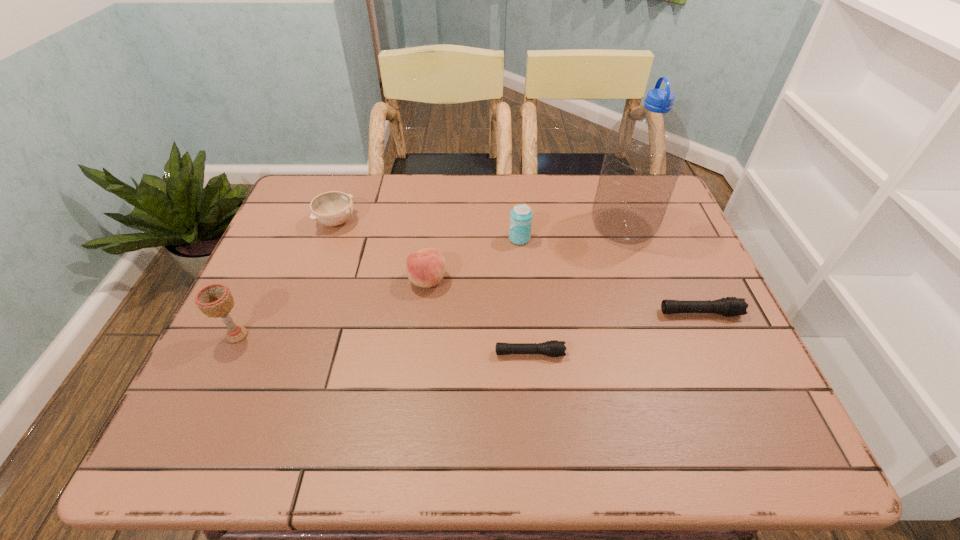
Locate an element on the screen. The width and height of the screenshot is (960, 540). the shorter flashlight is located at coordinates (555, 348).

Image resolution: width=960 pixels, height=540 pixels. What are the coordinates of `the shortest object` in the screenshot? It's located at (555, 348).

Locate an element on the screen. This screenshot has width=960, height=540. the farther flashlight is located at coordinates coord(731,306).

What are the coordinates of `the second shortest object` in the screenshot? It's located at (731, 306).

Identify the location of bowl. The image size is (960, 540). tap(333, 208).

Where is `the fifth tallest object`? The image size is (960, 540). the fifth tallest object is located at coordinates (333, 208).

At what (x,y) coordinates should I click in order to perform the action: click on beer can. Please return your answer as a coordinate pair (x, y). Looking at the image, I should click on (521, 215).

This screenshot has width=960, height=540. Find the location of `the tallest object`. the tallest object is located at coordinates (646, 149).

At what (x,y) coordinates should I click in order to perform the action: click on chalice. Please return your answer as a coordinate pair (x, y). Looking at the image, I should click on (215, 300).

Locate an element on the screen. Image resolution: width=960 pixels, height=540 pixels. the second tallest object is located at coordinates (215, 300).